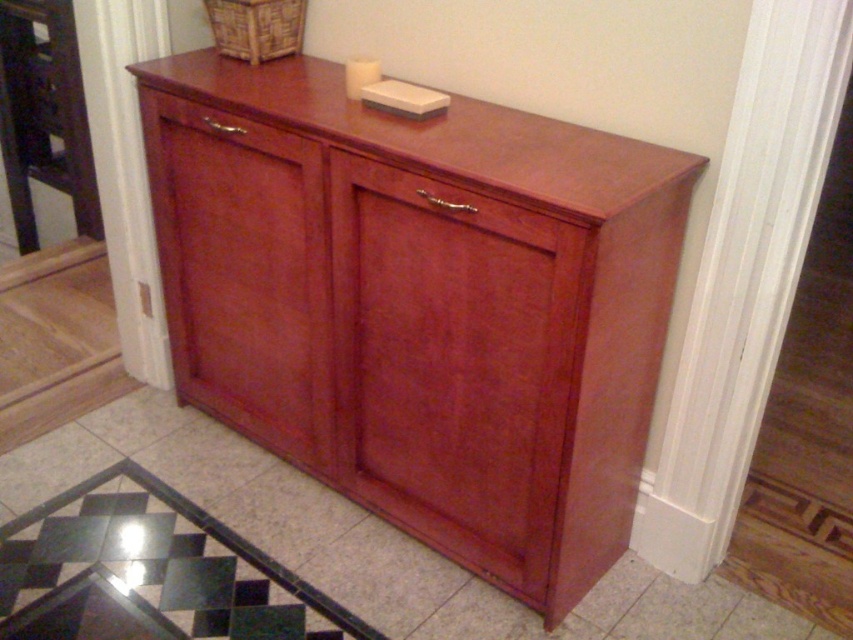
Question: Which object is closer to the camera taking this photo?

Choices:
 (A) matte wood drawer at center
 (B) satin cherry dresser at center

Answer: (B)

Question: Estimate the real-world distances between objects in this image. Which object is farther from the satin cherry dresser at center?

Choices:
 (A) glossy wood drawer at center
 (B) matte wood drawer at center

Answer: (B)

Question: Which object is the farthest from the satin cherry dresser at center?

Choices:
 (A) glossy wood drawer at center
 (B) matte wood drawer at center

Answer: (B)

Question: Is satin cherry dresser at center bigger than matte wood drawer at center?

Choices:
 (A) yes
 (B) no

Answer: (A)

Question: Does satin cherry dresser at center have a greater width compared to matte wood drawer at center?

Choices:
 (A) no
 (B) yes

Answer: (B)

Question: Can you confirm if glossy wood drawer at center is positioned above matte wood drawer at center?

Choices:
 (A) no
 (B) yes

Answer: (A)